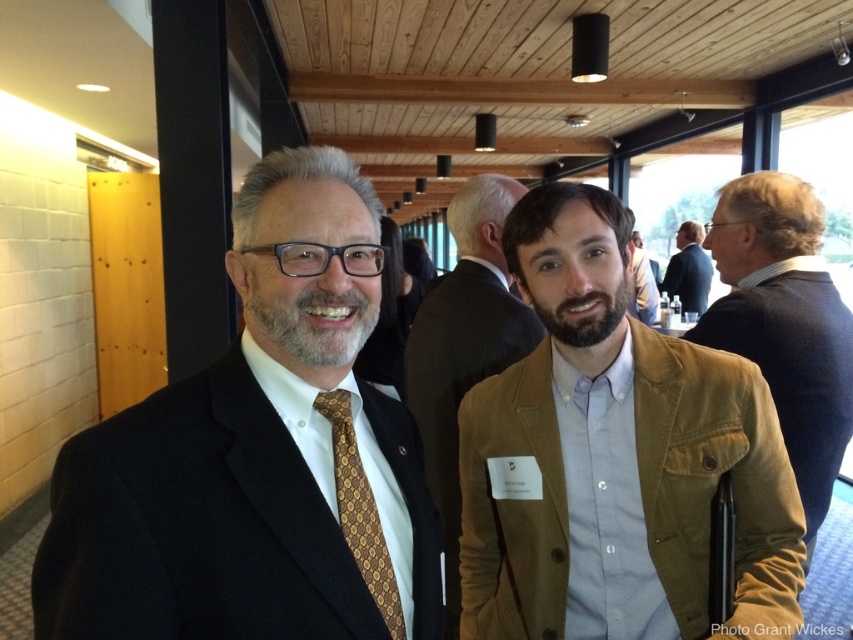
Is brown leather jacket at right further to camera compared to goldpatterned fabrictie at left?

Yes.

In the scene shown: Who is positioned more to the left, brown leather jacket at right or goldpatterned fabrictie at left?

From the viewer's perspective, goldpatterned fabrictie at left appears more on the left side.

What do you see at coordinates (784, 323) in the screenshot?
I see `brown leather jacket at right` at bounding box center [784, 323].

At what (x,y) coordinates should I click in order to perform the action: click on brown leather jacket at right. Please return your answer as a coordinate pair (x, y). The image size is (853, 640). Looking at the image, I should click on (784, 323).

Between brown suede jacket at center and goldpatterned fabrictie at left, which one has less height?

goldpatterned fabrictie at left

Does brown suede jacket at center appear on the right side of goldpatterned fabrictie at left?

Yes, brown suede jacket at center is to the right of goldpatterned fabrictie at left.

What do you see at coordinates (463, 348) in the screenshot? Image resolution: width=853 pixels, height=640 pixels. I see `brown suede jacket at center` at bounding box center [463, 348].

Where is `brown suede jacket at center`? brown suede jacket at center is located at coordinates (463, 348).

How distant is light brown corduroy blazer at center from goldpatterned fabrictie at left?

The distance of light brown corduroy blazer at center from goldpatterned fabrictie at left is 20.21 inches.

Does light brown corduroy blazer at center appear on the left side of goldpatterned fabrictie at left?

No, light brown corduroy blazer at center is not to the left of goldpatterned fabrictie at left.

This screenshot has height=640, width=853. In order to click on light brown corduroy blazer at center in this screenshot , I will do `click(614, 458)`.